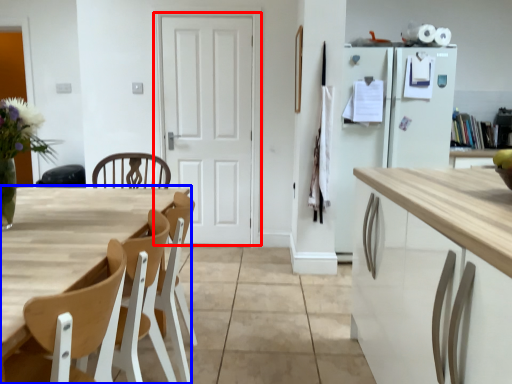
Question: Among these objects, which one is nearest to the camera, door (highlighted by a red box) or table (highlighted by a blue box)?

Choices:
 (A) door
 (B) table

Answer: (B)